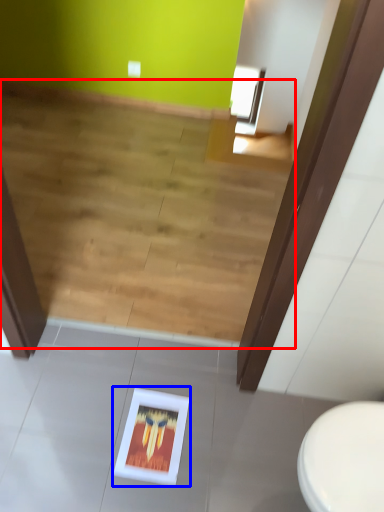
Question: Which object appears closest to the camera in this image, stairwell (highlighted by a red box) or picture frame (highlighted by a blue box)?

Choices:
 (A) stairwell
 (B) picture frame

Answer: (B)